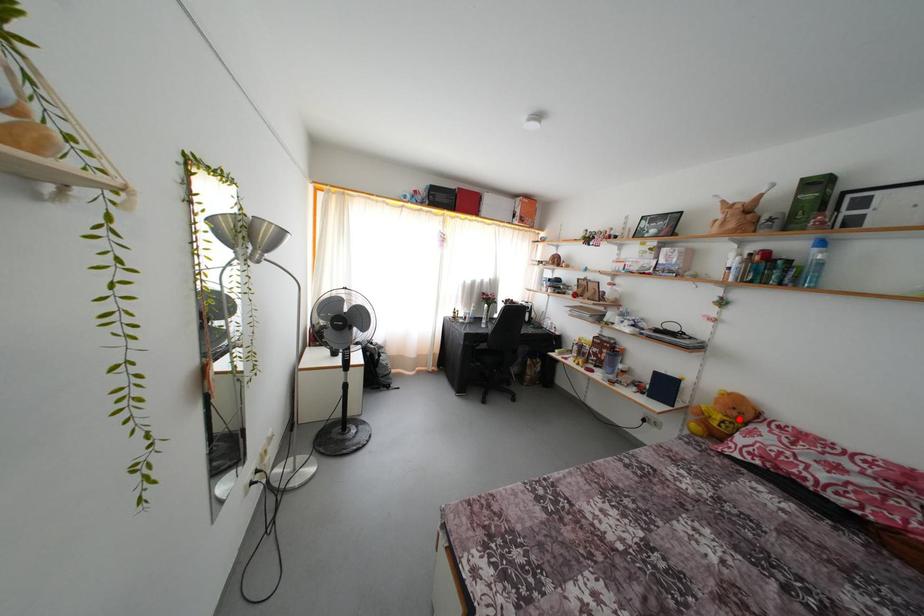
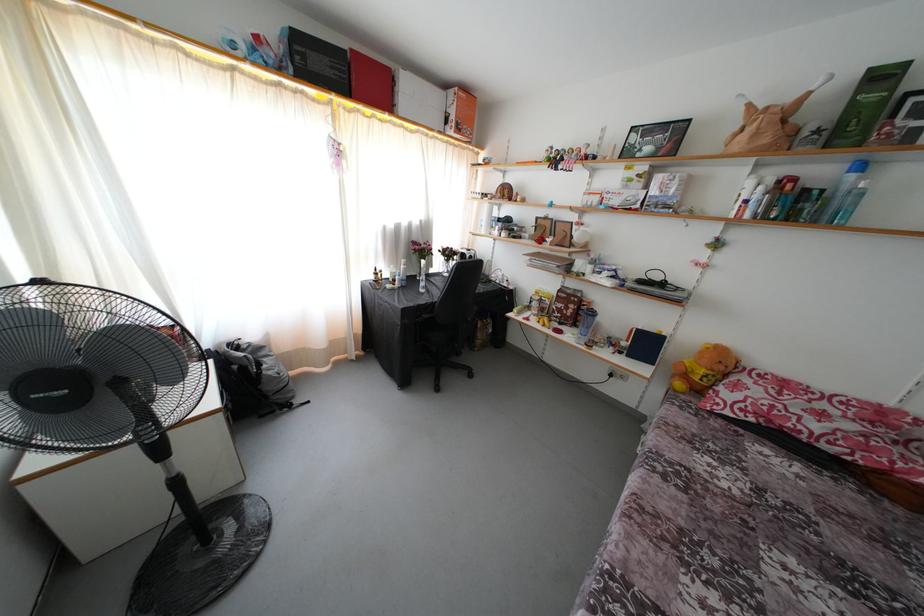
Find the pixel in the second image that matches the highlighted location in the first image.

(726, 373)